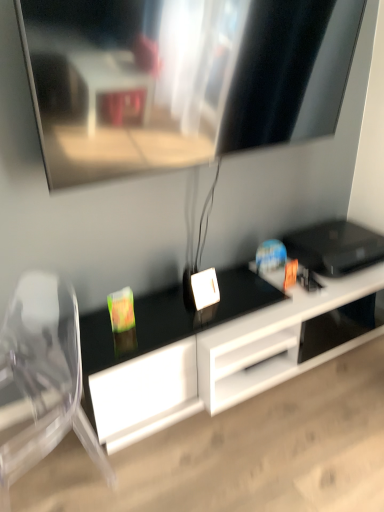
Question: From a real-world perspective, relative to black glossy desk at center, is transparent plastic swivel chair at left vertically above or below?

Choices:
 (A) above
 (B) below

Answer: (A)

Question: Is transparent plastic swivel chair at left taller or shorter than black glossy desk at center?

Choices:
 (A) short
 (B) tall

Answer: (B)

Question: From the image's perspective, is transparent plastic swivel chair at left positioned above or below black glossy desk at center?

Choices:
 (A) below
 (B) above

Answer: (A)

Question: In terms of width, does black glossy desk at center look wider or thinner when compared to transparent plastic swivel chair at left?

Choices:
 (A) wide
 (B) thin

Answer: (A)

Question: From a real-world perspective, is black glossy desk at center above or below transparent plastic swivel chair at left?

Choices:
 (A) above
 (B) below

Answer: (B)

Question: Does point (304, 360) appear closer or farther from the camera than point (18, 452)?

Choices:
 (A) farther
 (B) closer

Answer: (A)

Question: Would you say black glossy desk at center is inside or outside transparent plastic swivel chair at left?

Choices:
 (A) outside
 (B) inside

Answer: (A)